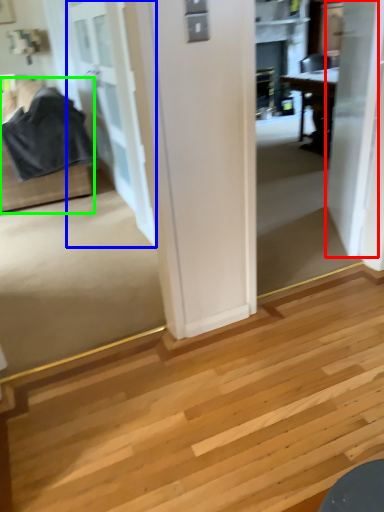
Question: Which object is positioned closest to door (highlighted by a red box)? Select from door (highlighted by a blue box) and furniture (highlighted by a green box).

Choices:
 (A) door
 (B) furniture

Answer: (A)